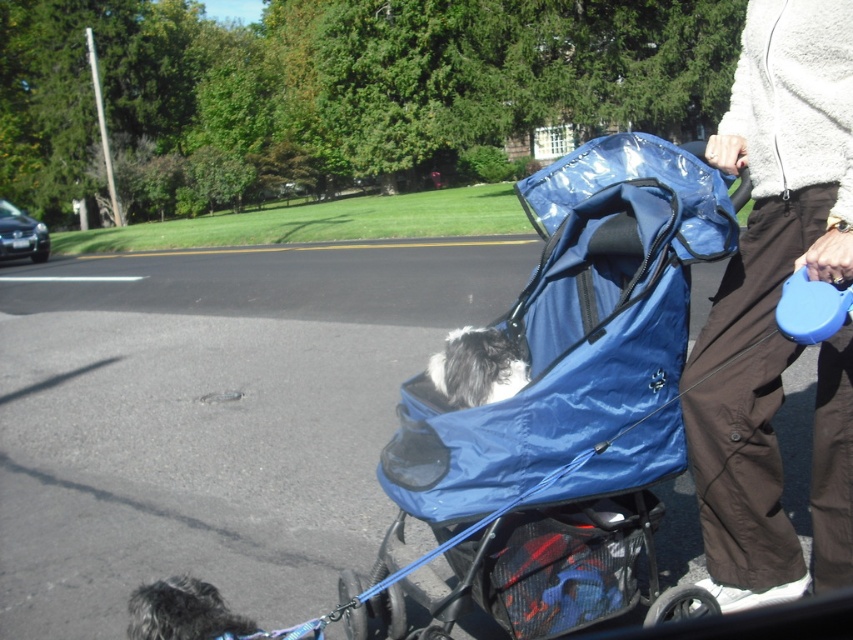
You are a pedestrian walking on the sidewalk and see the brown cotton pants at right and the shaggy fur dog at lower left. Which object is nearer to you?

The brown cotton pants at right is closer to the viewer than the shaggy fur dog at lower left.

You are a delivery robot that needs to pass through the path between the blue glossy stroller at center and the fluffy gray dog in stroller at center. The robot is 0.5 meters wide. Can it fit through the path?

The blue glossy stroller at center is larger in size than the fluffy gray dog in stroller at center. Since the stroller is larger, there might be enough space between them for the robot to pass. However, without specific distance information, it is uncertain. The robot should proceed with caution.

You are a pedestrian trying to cross the road safely. You see the brown cotton pants at right. Based on their position, can you estimate how far they are from the edge of the road?

The brown cotton pants at right are located at point (773, 308), which suggests they are relatively close to the edge of the road. However, without knowing the exact dimensions of the road or the coordinate system used, it is difficult to provide an exact distance.